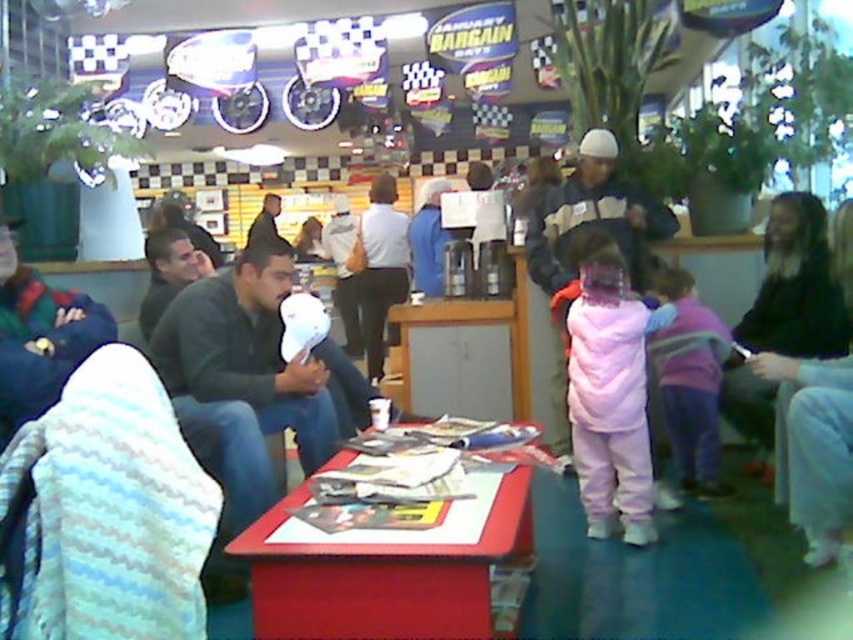
Question: Is striped knit sweater at center to the left of green fleece jacket at left from the viewer's perspective?

Choices:
 (A) no
 (B) yes

Answer: (A)

Question: Which of the following is the farthest from the observer?

Choices:
 (A) red plastic table at center
 (B) green fleece jacket at left

Answer: (B)

Question: Is red plastic table at center bigger than green fleece jacket at left?

Choices:
 (A) yes
 (B) no

Answer: (A)

Question: Can you confirm if green fleece jacket at left is positioned to the right of dark green sweater at center?

Choices:
 (A) yes
 (B) no

Answer: (A)

Question: Among these objects, which one is farthest from the camera?

Choices:
 (A) pink fleece jacket at center
 (B) green fleece jacket at left
 (C) dark green sweater at center
 (D) red plastic table at center

Answer: (C)

Question: Considering the real-world distances, which object is closest to the green fleece jacket at left?

Choices:
 (A) pink fleece jacket at center
 (B) dark green sweater at center

Answer: (A)